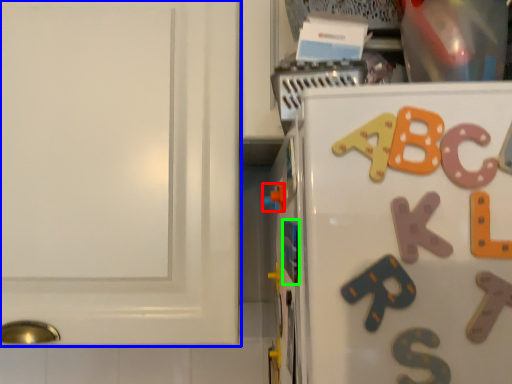
Question: Which object is the farthest from toy (highlighted by a red box)? Choose among these: cabinetry (highlighted by a blue box) or magnet (highlighted by a green box).

Choices:
 (A) cabinetry
 (B) magnet

Answer: (A)